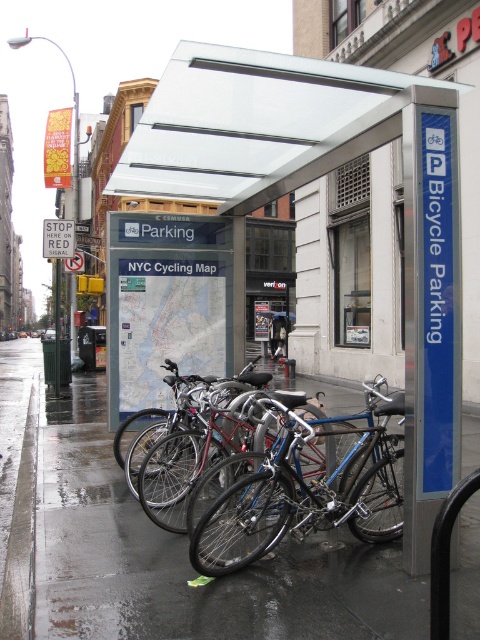
You are a cyclist who just arrived at the scene and need to park your bike. You see the metallic bicycle parking at center and the wet asphalt at lower center. Which surface is closer to you as you approach the parking area?

The metallic bicycle parking at center is closer to you since the wet asphalt at lower center is behind it.

You are a cyclist who just arrived at the bicycle parking area. You see the metallic bicycle parking at center and the metallic bicycle at center. Which object is positioned higher relative to the other?

The metallic bicycle parking at center is located above the metallic bicycle at center, so it is positioned higher.